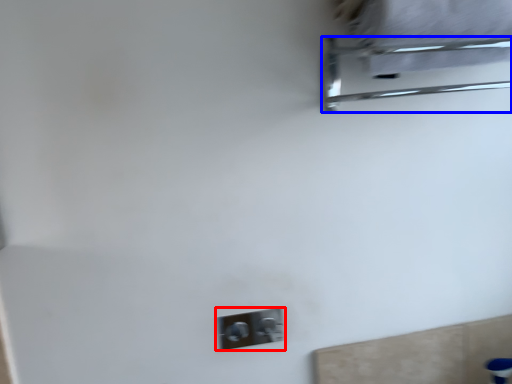
Question: Which object appears closest to the camera in this image, light switch (highlighted by a red box) or furniture (highlighted by a blue box)?

Choices:
 (A) light switch
 (B) furniture

Answer: (B)